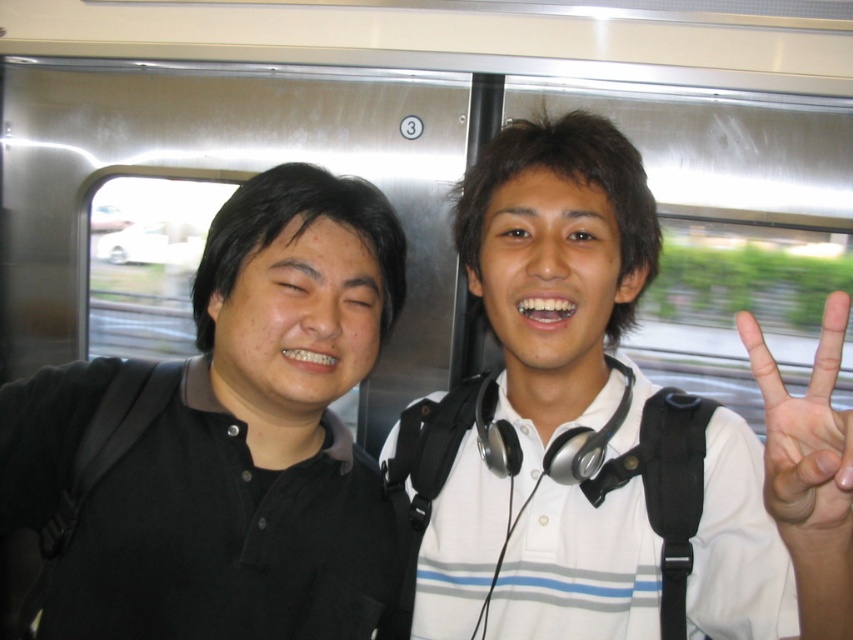
Question: Among these objects, which one is nearest to the camera?

Choices:
 (A) white matte shirt at center
 (B) black matte shirt at left
 (C) white matte hand at center right

Answer: (C)

Question: From the image, what is the correct spatial relationship of white matte shirt at center in relation to white matte hand at center right?

Choices:
 (A) below
 (B) above

Answer: (B)

Question: Can you confirm if black matte shirt at left is positioned below white matte hand at center right?

Choices:
 (A) yes
 (B) no

Answer: (B)

Question: Can you confirm if white matte shirt at center is wider than white matte hand at center right?

Choices:
 (A) yes
 (B) no

Answer: (A)

Question: Which is nearer to the white matte hand at center right?

Choices:
 (A) black matte shirt at left
 (B) white matte shirt at center

Answer: (B)

Question: Which point appears closest to the camera in this image?

Choices:
 (A) (479, 563)
 (B) (351, 369)
 (C) (798, 529)

Answer: (C)